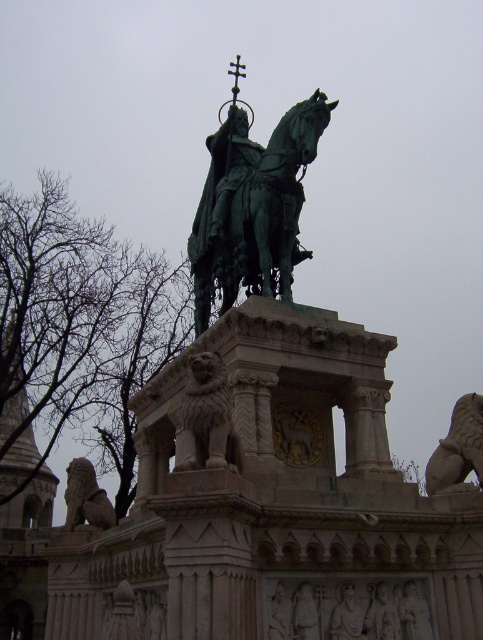
Question: Which object is positioned farthest from the stone lion at lower right?

Choices:
 (A) green polished metal horse at center
 (B) gray stone lion at lower left
 (C) gray stone lion at center

Answer: (B)

Question: Can you confirm if green polished metal horse at center is thinner than gray stone lion at center?

Choices:
 (A) no
 (B) yes

Answer: (A)

Question: Is gray stone lion at center closer to camera compared to gray stone lion at lower left?

Choices:
 (A) yes
 (B) no

Answer: (A)

Question: Is green polished metal horse at center thinner than gray stone lion at center?

Choices:
 (A) yes
 (B) no

Answer: (B)

Question: Which point is farther from the camera taking this photo?

Choices:
 (A) (72, 483)
 (B) (225, 374)
 (C) (208, 216)
 (D) (436, 481)

Answer: (C)

Question: Which of the following is the closest to the observer?

Choices:
 (A) green polished metal horse at center
 (B) gray stone lion at lower left
 (C) stone lion at lower right
 (D) gray stone lion at center

Answer: (D)